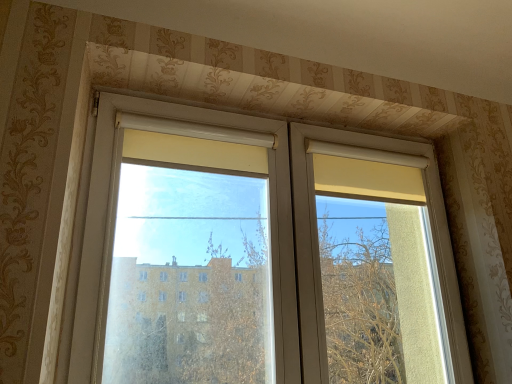
Question: Looking at their shapes, would you say transparent plastic window screen at center is wider or thinner than transparent glass window at center?

Choices:
 (A) thin
 (B) wide

Answer: (B)

Question: From their relative heights in the image, would you say transparent plastic window screen at center is taller or shorter than transparent glass window at center?

Choices:
 (A) tall
 (B) short

Answer: (B)

Question: In the image, is transparent plastic window screen at center on the left side or the right side of transparent glass window at center?

Choices:
 (A) left
 (B) right

Answer: (A)

Question: Is transparent glass window at center bigger or smaller than transparent plastic window screen at center?

Choices:
 (A) big
 (B) small

Answer: (A)

Question: From a real-world perspective, relative to transparent plastic window screen at center, is transparent glass window at center vertically above or below?

Choices:
 (A) below
 (B) above

Answer: (B)

Question: Considering the positions of transparent glass window at center and transparent plastic window screen at center in the image, is transparent glass window at center wider or thinner than transparent plastic window screen at center?

Choices:
 (A) thin
 (B) wide

Answer: (A)

Question: From the image's perspective, is transparent glass window at center positioned above or below transparent plastic window screen at center?

Choices:
 (A) below
 (B) above

Answer: (A)